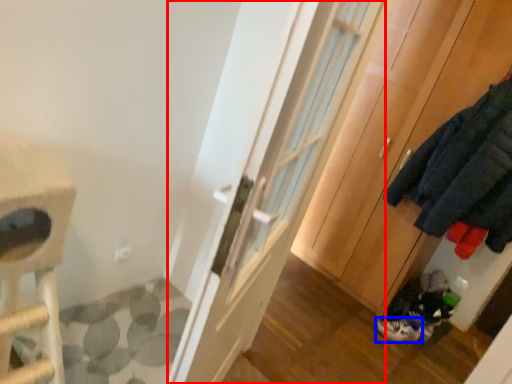
Question: Which point is further to the camera, door (highlighted by a red box) or footwear (highlighted by a blue box)?

Choices:
 (A) door
 (B) footwear

Answer: (B)